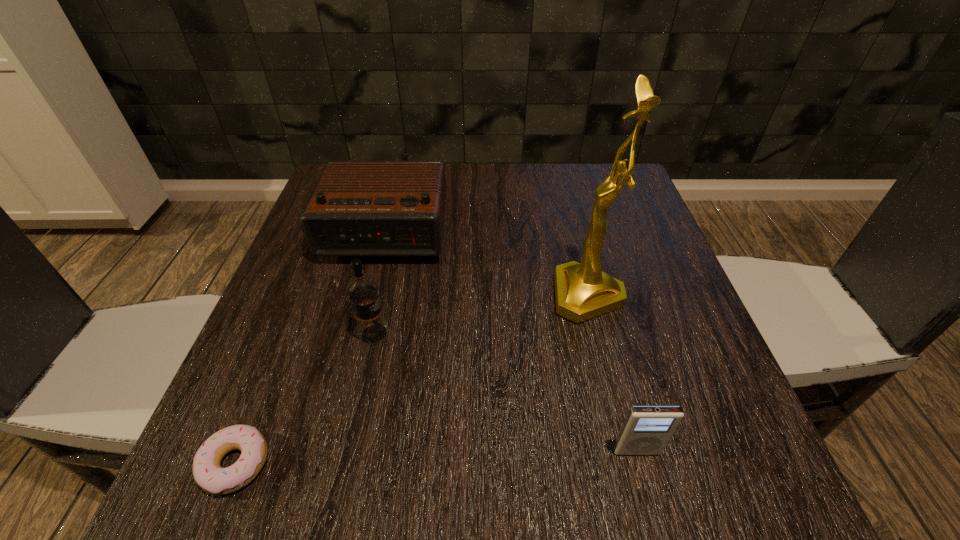
Locate an element on the screen. vacant area between the doughnut and the farthest object is located at coordinates (309, 349).

Find the location of `free space that is in between the third tallest object and the second tallest object`. free space that is in between the third tallest object and the second tallest object is located at coordinates (378, 284).

Identify the location of vacant space in between the second tallest object and the tallest object. (481, 315).

Identify the location of vacant region between the vodka and the farthest object. This screenshot has height=540, width=960. (378, 284).

Locate an element on the screen. The image size is (960, 540). vacant region between the radio receiver and the second shortest object is located at coordinates (509, 342).

Where is `vacant point located between the shortest object and the tallest object`? vacant point located between the shortest object and the tallest object is located at coordinates (412, 380).

You are a GUI agent. You are given a task and a screenshot of the screen. Output one action in this format:
    pyautogui.click(x=<x>, y=<y>)
    Task: Click on the free spot between the second shortest object and the farthest object
    The height and width of the screenshot is (540, 960).
    Given the screenshot: What is the action you would take?
    pyautogui.click(x=509, y=342)

I want to click on vacant area that lies between the radio receiver and the doughnut, so click(309, 349).

Find the location of a particular element. This screenshot has width=960, height=540. free space between the fourth shortest object and the radio receiver is located at coordinates click(x=378, y=284).

Locate which object is the closest to the second tallest object. Please provide its 2D coordinates. Your answer should be formatted as a tuple, i.e. [(x, y)], where the tuple contains the x and y coordinates of a point satisfying the conditions above.

[(359, 208)]